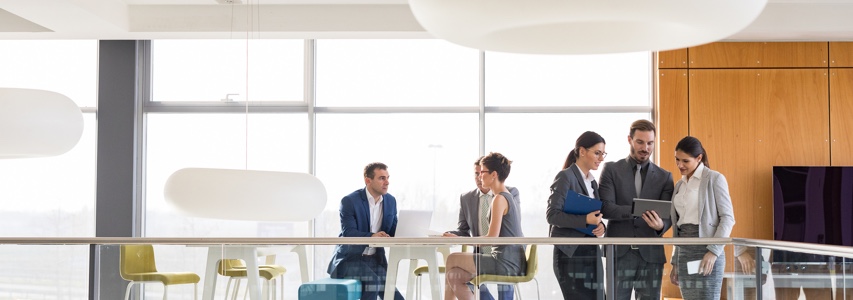
Where is `chair`? The image size is (853, 300). chair is located at coordinates (147, 265), (240, 272), (403, 253), (526, 273).